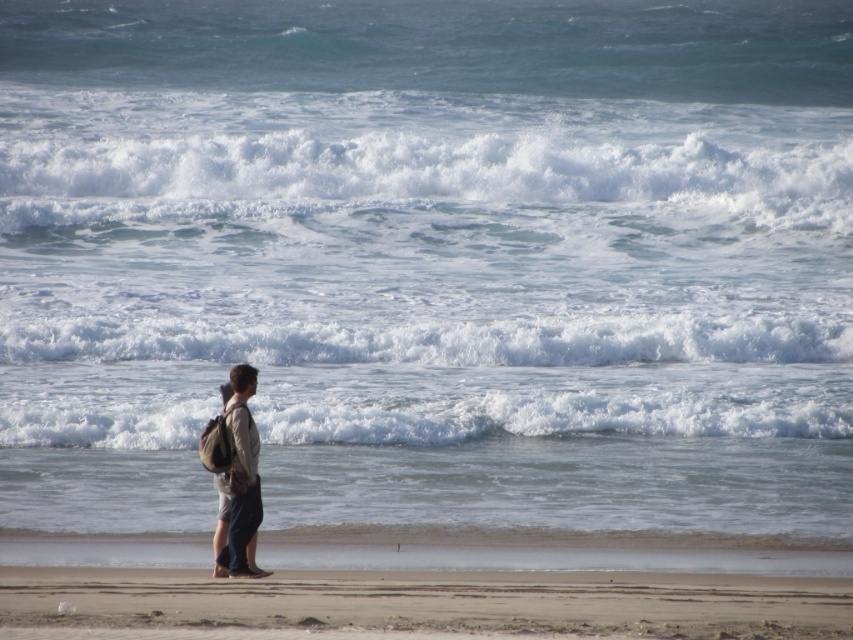
Can you confirm if white frothy wave at upper center is taller than sandy beach at lower center?

Indeed, white frothy wave at upper center has a greater height compared to sandy beach at lower center.

At what (x,y) coordinates should I click in order to perform the action: click on white frothy wave at upper center. Please return your answer as a coordinate pair (x, y). The height and width of the screenshot is (640, 853). Looking at the image, I should click on (422, 186).

Is point (416, 161) behind point (96, 609)?

Yes, it is behind point (96, 609).

The width and height of the screenshot is (853, 640). I want to click on white frothy wave at upper center, so click(422, 186).

Consider the image. Does white frothy wave at upper center appear under light brown fabric backpack at center?

Incorrect, white frothy wave at upper center is not positioned below light brown fabric backpack at center.

Can you confirm if white frothy wave at upper center is thinner than light brown fabric backpack at center?

No.

You are a GUI agent. You are given a task and a screenshot of the screen. Output one action in this format:
    pyautogui.click(x=<x>, y=<y>)
    Task: Click on the white frothy wave at upper center
    The width and height of the screenshot is (853, 640).
    Given the screenshot: What is the action you would take?
    pyautogui.click(x=422, y=186)

This screenshot has height=640, width=853. In order to click on sandy beach at lower center in this screenshot , I will do `click(421, 604)`.

Between sandy beach at lower center and light brown fabric backpack at center, which one appears on the right side from the viewer's perspective?

sandy beach at lower center

Which is behind, point (587, 614) or point (212, 572)?

The point (212, 572) is more distant.

Where is `sandy beach at lower center`? The height and width of the screenshot is (640, 853). sandy beach at lower center is located at coordinates (421, 604).